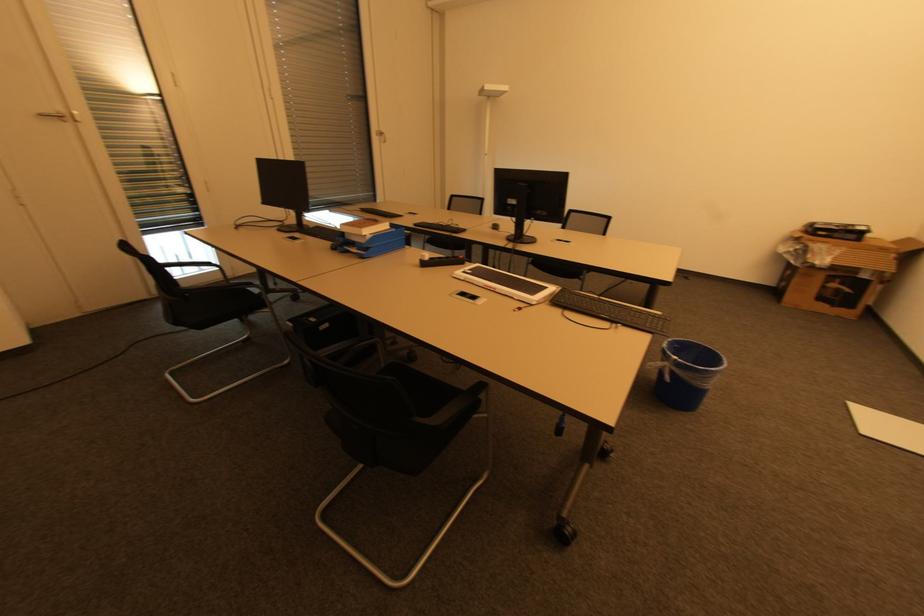
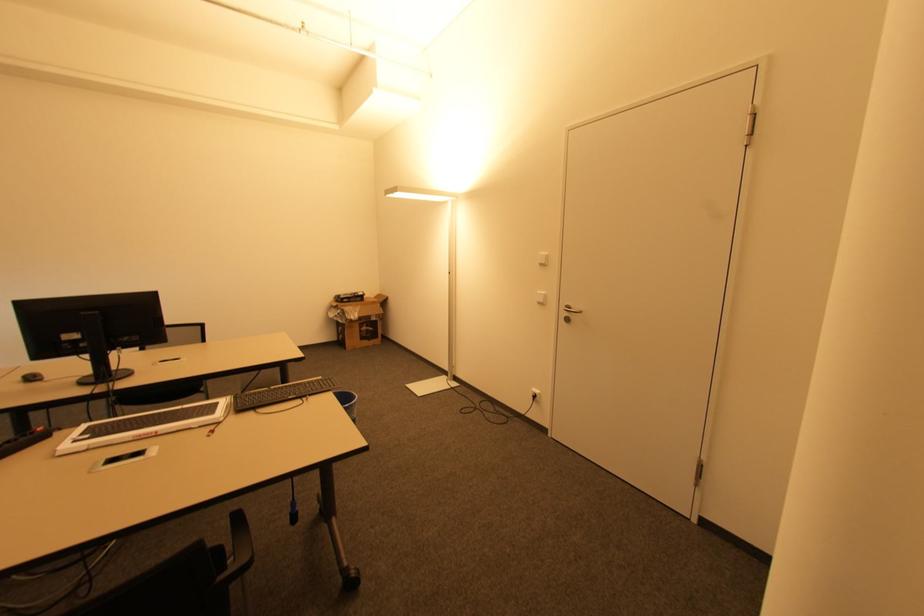
Where in the second image is the point corresponding to point (723, 358) from the first image?

(353, 394)